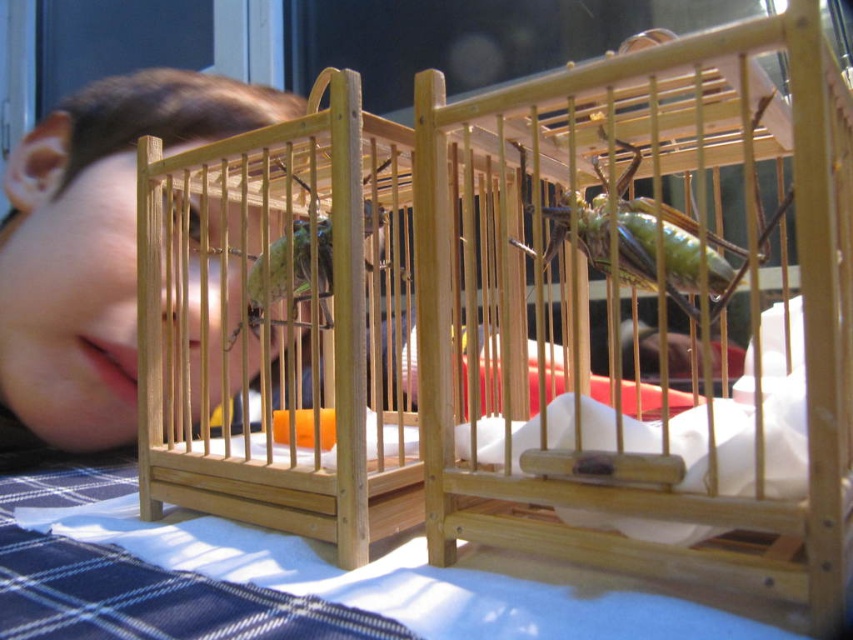
Question: Which object appears closest to the camera in this image?

Choices:
 (A) green matte insect at center
 (B) green matte grasshopper at center
 (C) smooth skin face at upper left

Answer: (A)

Question: Is smooth skin face at upper left in front of green matte grasshopper at center?

Choices:
 (A) yes
 (B) no

Answer: (B)

Question: Considering the relative positions of green matte insect at center and green matte grasshopper at center in the image provided, where is green matte insect at center located with respect to green matte grasshopper at center?

Choices:
 (A) below
 (B) above

Answer: (B)

Question: Which object is farther from the camera taking this photo?

Choices:
 (A) smooth skin face at upper left
 (B) green matte insect at center
 (C) green matte grasshopper at center

Answer: (A)

Question: Is smooth skin face at upper left smaller than green matte insect at center?

Choices:
 (A) yes
 (B) no

Answer: (B)

Question: Which object appears farthest from the camera in this image?

Choices:
 (A) green matte grasshopper at center
 (B) green matte insect at center

Answer: (A)